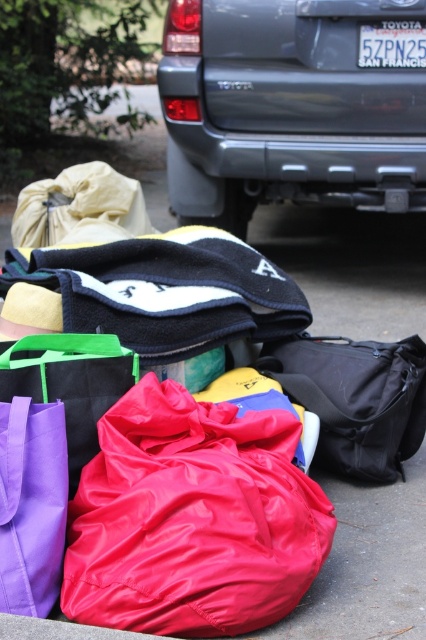
Question: Is gray matte suv at center thinner than shiny red sleeping bag at center?

Choices:
 (A) yes
 (B) no

Answer: (B)

Question: Can you confirm if gray matte suv at center is positioned below shiny red sleeping bag at center?

Choices:
 (A) no
 (B) yes

Answer: (A)

Question: Which of the following is the farthest from the observer?

Choices:
 (A) gray matte suv at center
 (B) rubberized fabric bags at center

Answer: (A)

Question: Considering the relative positions of shiny red sleeping bag at center and black matte duffel bag at center in the image provided, where is shiny red sleeping bag at center located with respect to black matte duffel bag at center?

Choices:
 (A) right
 (B) left

Answer: (B)

Question: Estimate the real-world distances between objects in this image. Which object is closer to the shiny red sleeping bag at center?

Choices:
 (A) rubberized fabric bags at center
 (B) gray matte suv at center
 (C) black matte duffel bag at center
 (D) 5zpn25 plastic at center

Answer: (C)

Question: Considering the real-world distances, which object is closest to the gray matte suv at center?

Choices:
 (A) 5zpn25 plastic at center
 (B) rubberized fabric bags at center

Answer: (A)